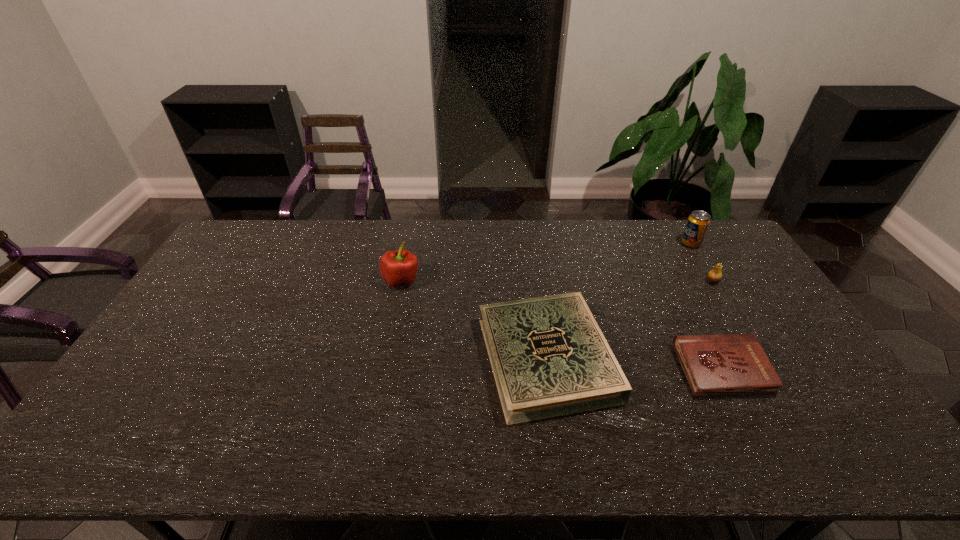
I want to click on object that stands as the second closest to the pear, so click(734, 364).

The width and height of the screenshot is (960, 540). I want to click on object that is the second closest to the farthest object, so click(734, 364).